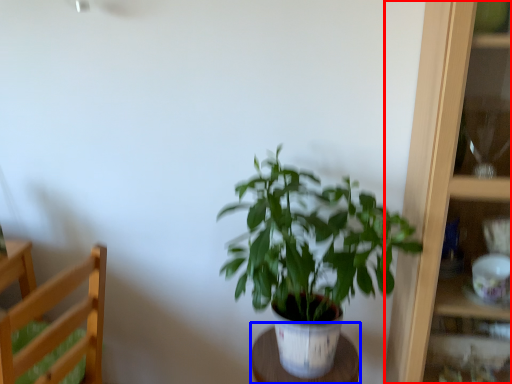
Question: Which object appears closest to the camera in this image, cabinet (highlighted by a red box) or table (highlighted by a blue box)?

Choices:
 (A) cabinet
 (B) table

Answer: (A)